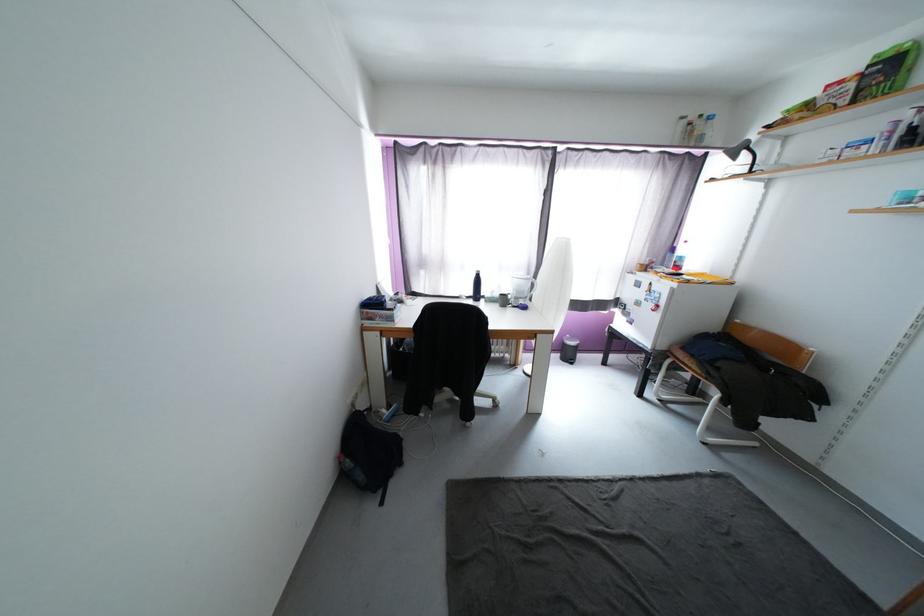
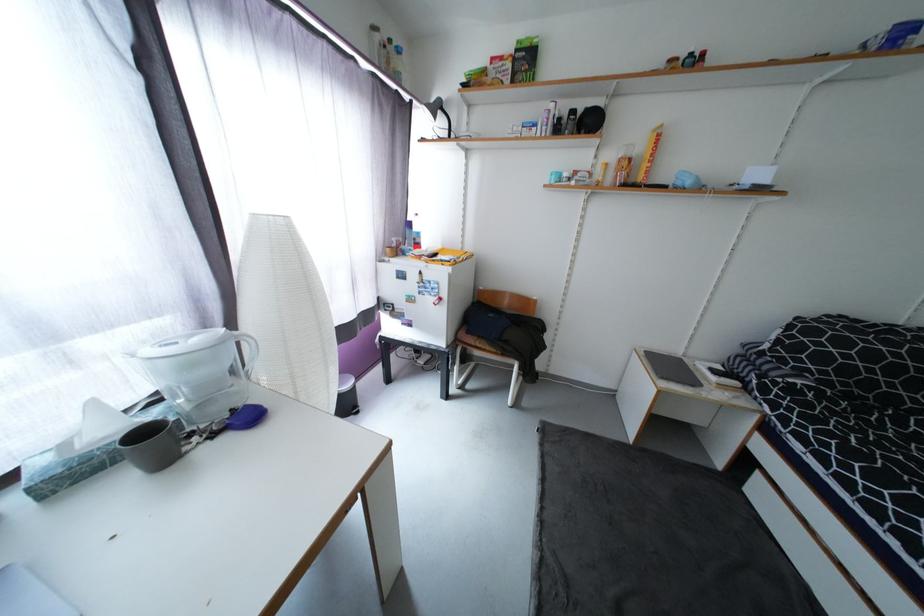
Locate, in the second image, the point that corresponds to (694,283) in the first image.

(460, 264)